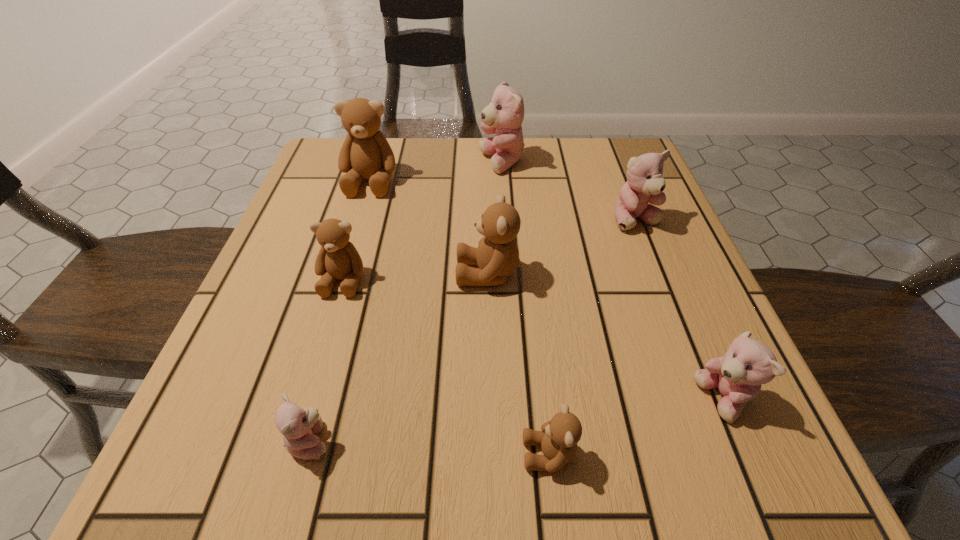
Find the location of `blank area located at the face of the third biggest pink teddy bear`. blank area located at the face of the third biggest pink teddy bear is located at coordinates [562, 400].

Image resolution: width=960 pixels, height=540 pixels. In order to click on vacant point located at the face of the third biggest pink teddy bear in this screenshot , I will do `click(639, 400)`.

I want to click on free space located on the front-facing side of the smallest brown teddy bear, so click(360, 454).

Locate an element on the screen. The image size is (960, 540). free space located on the front-facing side of the smallest brown teddy bear is located at coordinates (290, 454).

Where is `free location located on the front-facing side of the smallest brown teddy bear`? free location located on the front-facing side of the smallest brown teddy bear is located at coordinates (298, 454).

The height and width of the screenshot is (540, 960). I want to click on vacant space located at the face of the leftmost pink teddy bear, so click(x=537, y=441).

Image resolution: width=960 pixels, height=540 pixels. I want to click on object that is at the far left corner, so click(365, 153).

You are a GUI agent. You are given a task and a screenshot of the screen. Output one action in this format:
    pyautogui.click(x=<x>, y=<y>)
    Task: Click on the object that is at the near left corner
    
    Given the screenshot: What is the action you would take?
    pyautogui.click(x=299, y=426)

Locate an element on the screen. Image resolution: width=960 pixels, height=540 pixels. object located at the near right corner is located at coordinates (748, 363).

Identify the location of vacant space at the far edge. This screenshot has height=540, width=960. (468, 152).